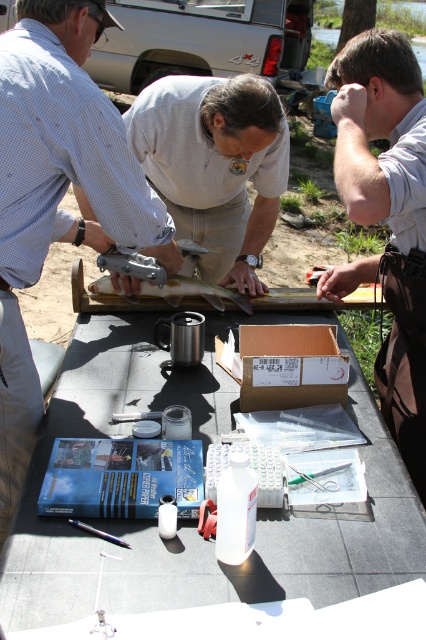
Can you confirm if white apron at right is positioned below brown cardboard box at center?

Incorrect, white apron at right is not positioned below brown cardboard box at center.

Is white apron at right taller than brown cardboard box at center?

Indeed, white apron at right has a greater height compared to brown cardboard box at center.

This screenshot has height=640, width=426. Describe the element at coordinates (386, 218) in the screenshot. I see `white apron at right` at that location.

Find the location of `white apron at right`. white apron at right is located at coordinates (386, 218).

Which of these two, matte black shirt at upper left or white apron at right, stands taller?

matte black shirt at upper left is taller.

Does matte black shirt at upper left appear on the left side of white apron at right?

Correct, you'll find matte black shirt at upper left to the left of white apron at right.

At what (x,y) coordinates should I click in order to perform the action: click on matte black shirt at upper left. Please return your answer as a coordinate pair (x, y). This screenshot has width=426, height=640. Looking at the image, I should click on (55, 193).

Between gray rubber table at center and brown cardboard box at center, which one has less height?

With less height is brown cardboard box at center.

Between gray rubber table at center and brown cardboard box at center, which one appears on the left side from the viewer's perspective?

Positioned to the left is gray rubber table at center.

Between point (362, 566) and point (324, 364), which one is positioned in front?

Point (362, 566)

I want to click on gray rubber table at center, so click(195, 518).